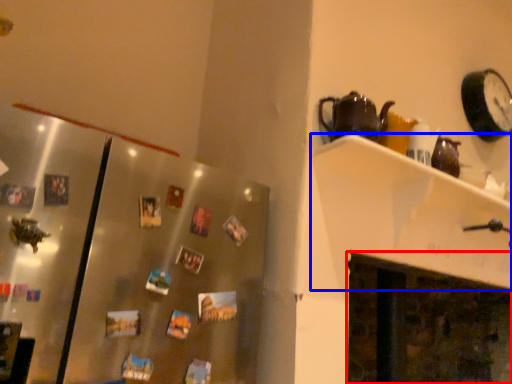
Question: Which object is closer to the camera taking this photo, fireplace (highlighted by a red box) or shelf (highlighted by a blue box)?

Choices:
 (A) fireplace
 (B) shelf

Answer: (B)